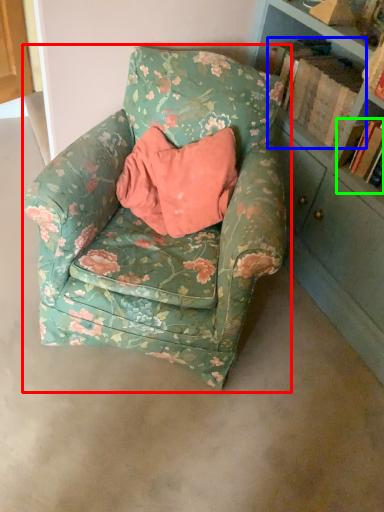
Question: Based on their relative distances, which object is farther from chair (highlighted by a red box)? Choose from book (highlighted by a blue box) and book (highlighted by a green box).

Choices:
 (A) book
 (B) book

Answer: (B)